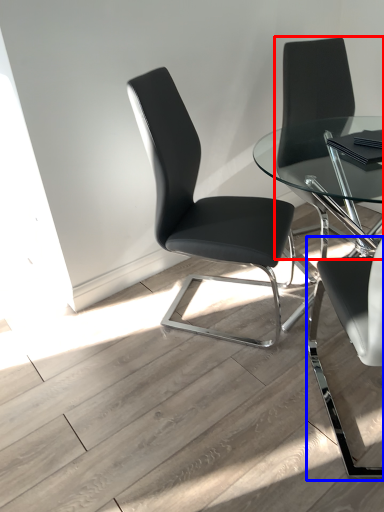
Question: Which object appears farthest to the camera in this image, chair (highlighted by a red box) or chair (highlighted by a blue box)?

Choices:
 (A) chair
 (B) chair

Answer: (A)